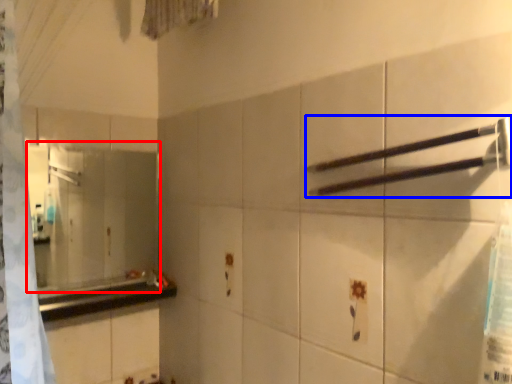
Question: Which of the following is the farthest to the observer, mirror (highlighted by a red box) or towel bar (highlighted by a blue box)?

Choices:
 (A) mirror
 (B) towel bar

Answer: (A)